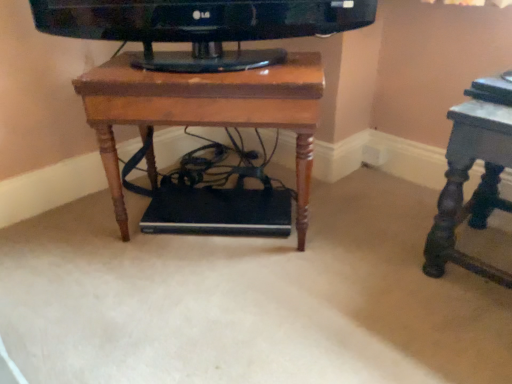
Question: From the image's perspective, is wooden table at center, arranged as the 2th table when viewed from the right, positioned above or below dark gray polished wood table at right, positioned as the first table in right-to-left order?

Choices:
 (A) above
 (B) below

Answer: (A)

Question: Is wooden table at center, arranged as the first table when viewed from the left, taller or shorter than dark gray polished wood table at right, which is counted as the second table, starting from the left?

Choices:
 (A) tall
 (B) short

Answer: (A)

Question: Considering the positions of wooden table at center, arranged as the 2th table when viewed from the right, and dark gray polished wood table at right, positioned as the first table in right-to-left order, in the image, is wooden table at center, arranged as the 2th table when viewed from the right, bigger or smaller than dark gray polished wood table at right, positioned as the first table in right-to-left order,?

Choices:
 (A) big
 (B) small

Answer: (A)

Question: From the image's perspective, is dark gray polished wood table at right, which is counted as the second table, starting from the left, above or below wooden table at center, arranged as the first table when viewed from the left?

Choices:
 (A) above
 (B) below

Answer: (B)

Question: Is point (501, 117) closer or farther from the camera than point (309, 84)?

Choices:
 (A) closer
 (B) farther

Answer: (A)

Question: From a real-world perspective, is dark gray polished wood table at right, positioned as the first table in right-to-left order, above or below wooden table at center, arranged as the first table when viewed from the left?

Choices:
 (A) above
 (B) below

Answer: (B)

Question: Is dark gray polished wood table at right, positioned as the first table in right-to-left order, situated inside wooden table at center, arranged as the first table when viewed from the left, or outside?

Choices:
 (A) inside
 (B) outside

Answer: (B)